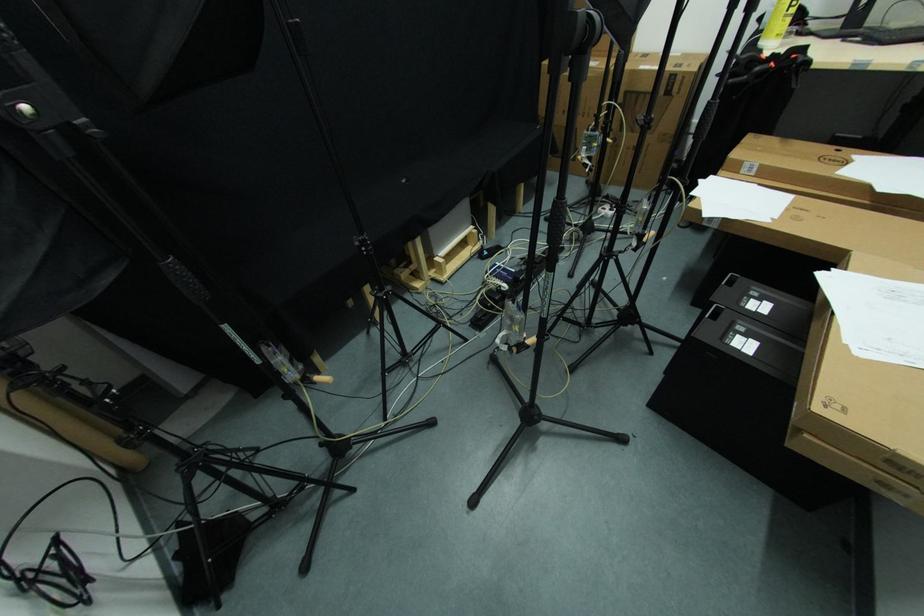
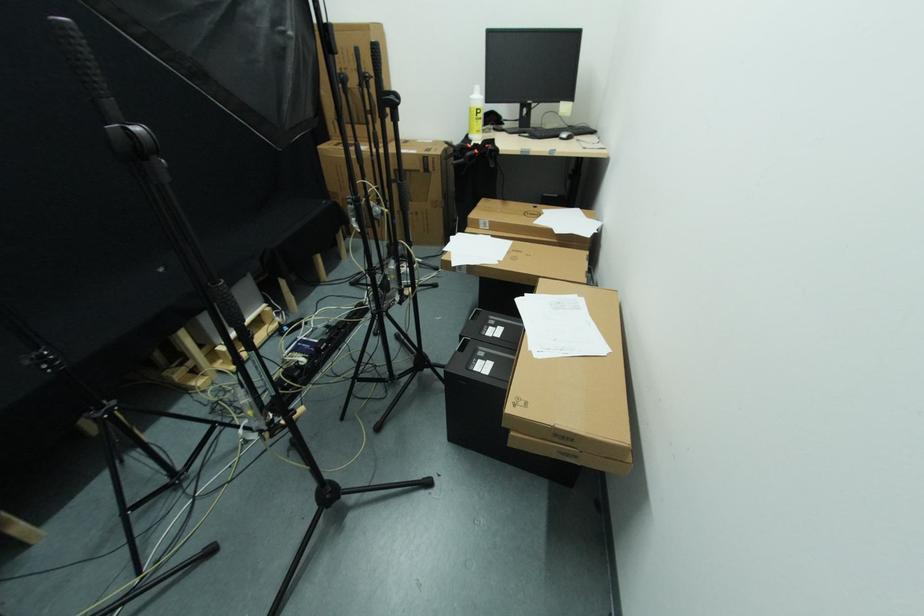
In the second image, find the point that corresponds to point (748, 339) in the first image.

(487, 361)